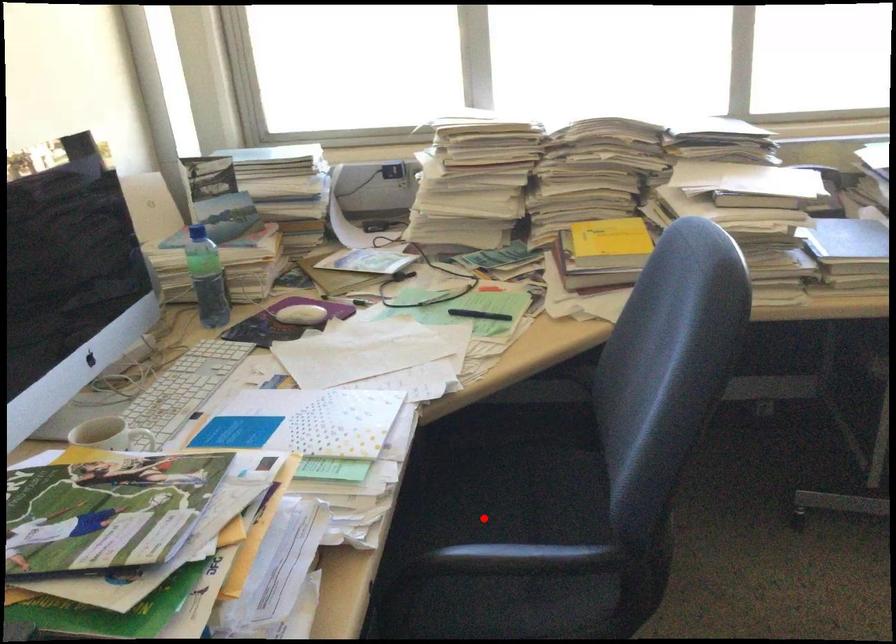
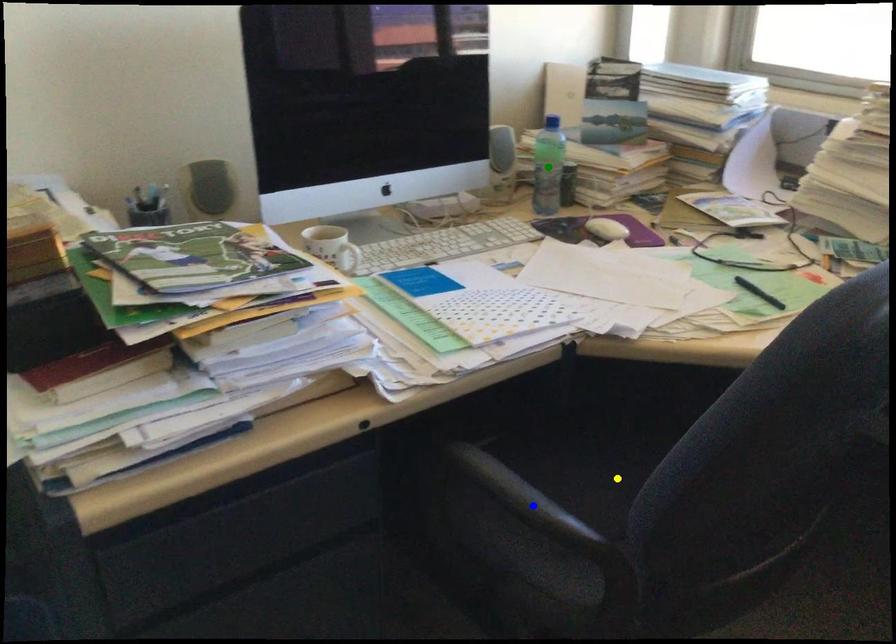
Question: I am providing you with two images of the same scene from different viewpoints. A red point is marked on the first image. You are given multiple points on the second image. In image 2, which mark is for the same physical point as the one in image 1?

Choices:
 (A) yellow point
 (B) blue point
 (C) green point

Answer: (A)